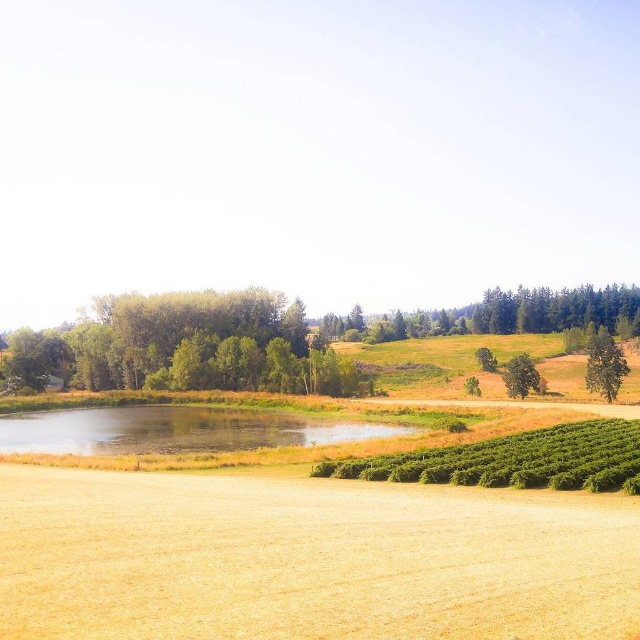
Question: Which point is farther to the camera?

Choices:
 (A) (602, 358)
 (B) (621, 467)

Answer: (A)

Question: Can you confirm if green leafy hedge at lower right is thinner than green leafy tree at right?

Choices:
 (A) yes
 (B) no

Answer: (A)

Question: Which of the following is the closest to the observer?

Choices:
 (A) clear water at center
 (B) green leafy trees at left

Answer: (A)

Question: Among these objects, which one is farthest from the camera?

Choices:
 (A) green leafy tree at right
 (B) clear water at center

Answer: (A)

Question: Is clear water at center further to the viewer compared to green leafy tree at center-right?

Choices:
 (A) yes
 (B) no

Answer: (B)

Question: Can you confirm if green leafy hedge at lower right is wider than green textured tree at center?

Choices:
 (A) yes
 (B) no

Answer: (B)